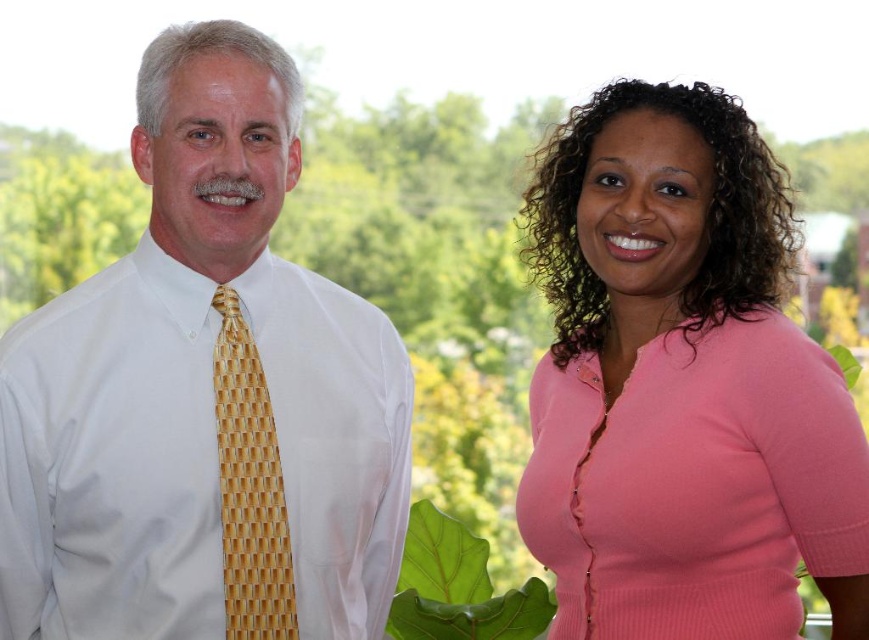
Looking at this image, you are a photographer setting up for a portrait. You want to ensure that both the white woven tie at left and the green leafy plant at lower center are in focus. Given that your camera has a depth of field that can cover 30 inches, will both subjects be in focus?

The distance between the white woven tie at left and the green leafy plant at lower center is 30.73 inches. Since the depth of field can only cover 30 inches, the two subjects are slightly beyond the camera settings, so they might not both be in focus simultaneously.

You are a photographer setting up for a group photo. You need to position the yellow woven tie at left and the green leafy plant at lower center so that the tie is visible in the frame. Based on their current positions, which object is closer to the left edge of the photo?

The yellow woven tie at left is to the left of the green leafy plant at lower center, so it is closer to the left edge of the photo.

You are a photographer setting up for a portrait. You need to ensure that the pink ribbed sweater at right and the green leafy plant at lower center are both visible in the frame. Based on their sizes, which object will occupy more vertical space in the photo?

The pink ribbed sweater at right is much taller than the green leafy plant at lower center, so it will occupy more vertical space in the photo.